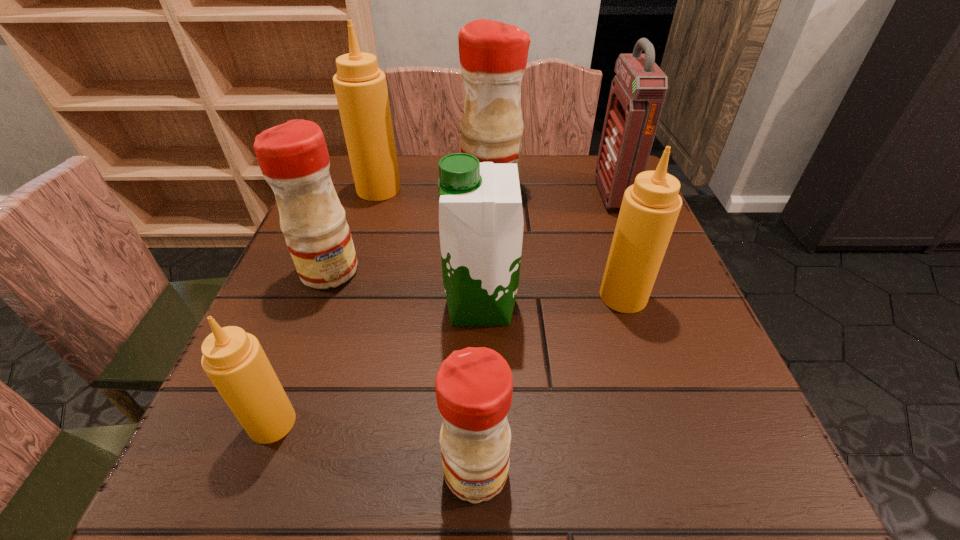
Identify the location of the biggest tan condiment. (360, 86).

Find the location of `the biggest red condiment`. the biggest red condiment is located at coordinates (493, 55).

This screenshot has height=540, width=960. What are the coordinates of `red first-aid kit` in the screenshot? It's located at (638, 91).

In order to click on the rightmost tan condiment in this screenshot , I will do `click(650, 207)`.

Locate an element on the screen. The image size is (960, 540). the second nearest tan condiment is located at coordinates (650, 207).

This screenshot has width=960, height=540. Find the location of `the leftmost red condiment`. the leftmost red condiment is located at coordinates (293, 157).

At what (x,y) coordinates should I click in order to perform the action: click on the second nearest red condiment. Please return your answer as a coordinate pair (x, y). The width and height of the screenshot is (960, 540). Looking at the image, I should click on (293, 157).

Where is `soya milk`? soya milk is located at coordinates (481, 222).

Image resolution: width=960 pixels, height=540 pixels. Find the location of `the nearest tan condiment`. the nearest tan condiment is located at coordinates (234, 361).

The image size is (960, 540). Identify the location of the smallest red condiment. (474, 386).